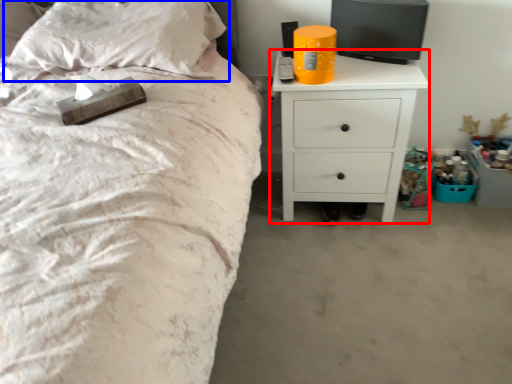
Question: Which of the following is the farthest to the observer, nightstand (highlighted by a red box) or pillow (highlighted by a blue box)?

Choices:
 (A) nightstand
 (B) pillow

Answer: (A)